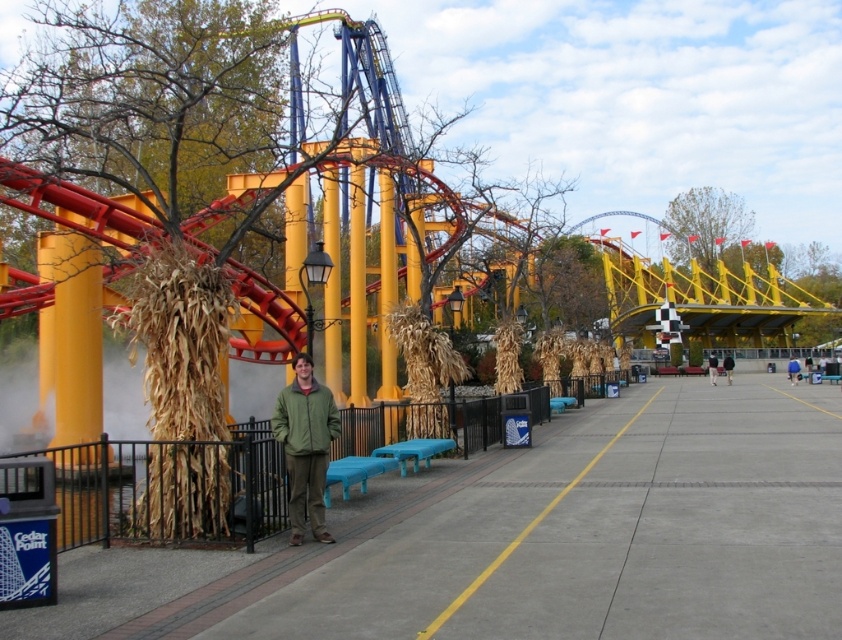
You are a photographer trying to capture a candid shot of the man in the blue fabric jacket at center and dark blue jeans at center. Since you want to focus on the jacket, which part of the man should you zoom in on more?

The blue fabric jacket at center is closer to the viewer than dark blue jeans at center, so you should zoom in on the blue fabric jacket at center to focus on it.